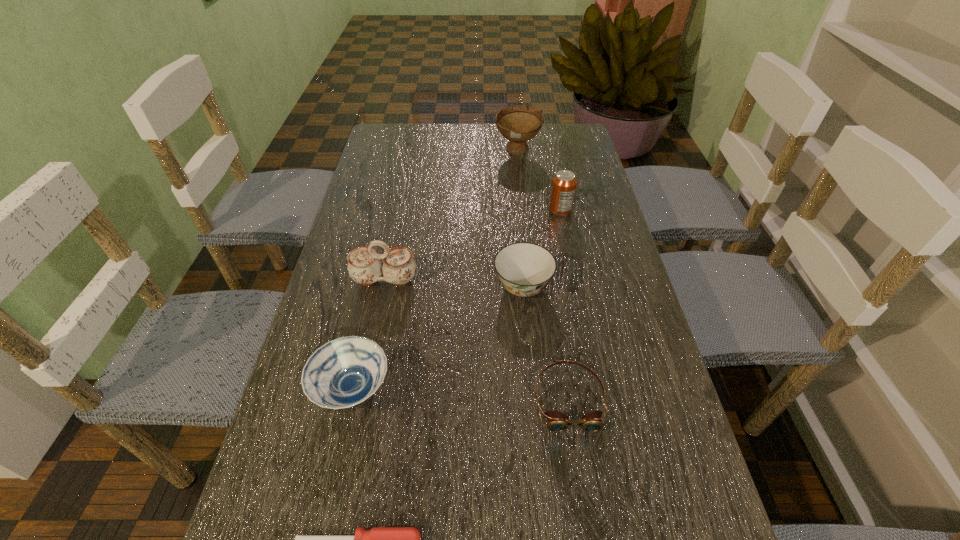
The image size is (960, 540). I want to click on object that is the second nearest to the second shortest object, so click(379, 539).

Locate which soup bowl ranks third in proximity to the goggles. Please provide its 2D coordinates. Your answer should be formatted as a tuple, i.e. [(x, y)], where the tuple contains the x and y coordinates of a point satisfying the conditions above.

[(519, 123)]

Locate an element on the screen. soup bowl that can be found as the third closest to the sixth tallest object is located at coordinates (519, 123).

Find the location of a particular element. The height and width of the screenshot is (540, 960). vacant space that satisfies the following two spatial constraints: 1. by the handle of the second farthest soup bowl; 2. on the left side of the chinaware is located at coordinates (383, 287).